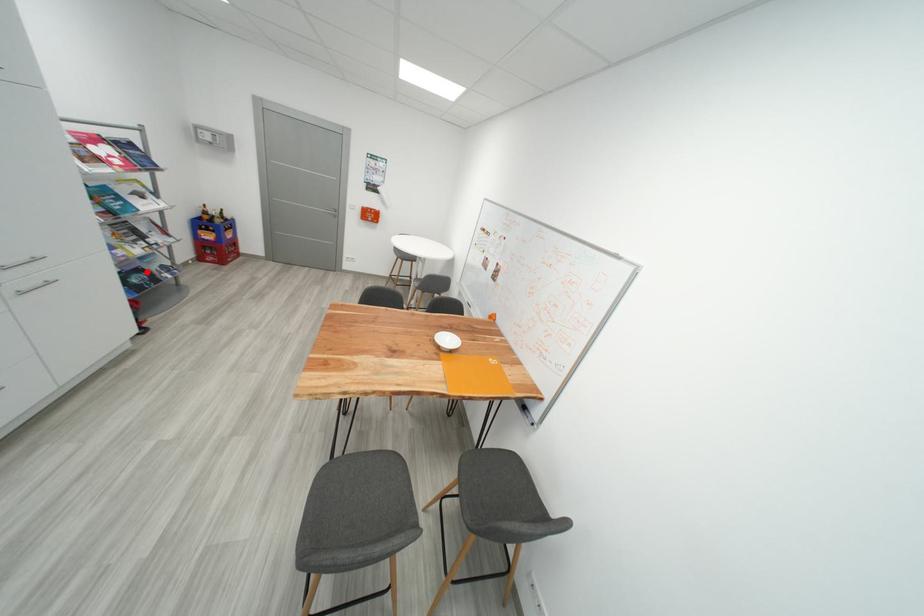
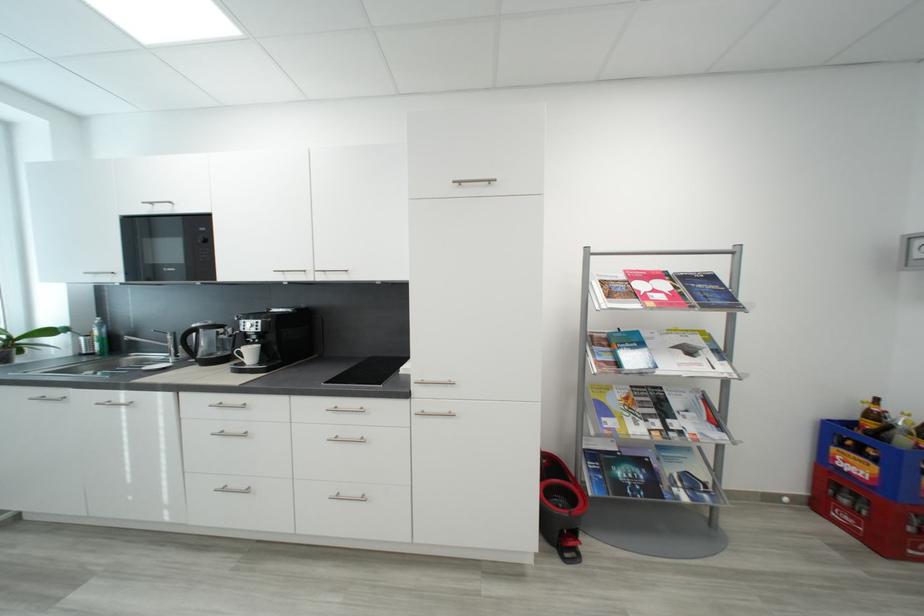
In the second image, find the point that corresponds to the highlighted location in the first image.

(650, 464)